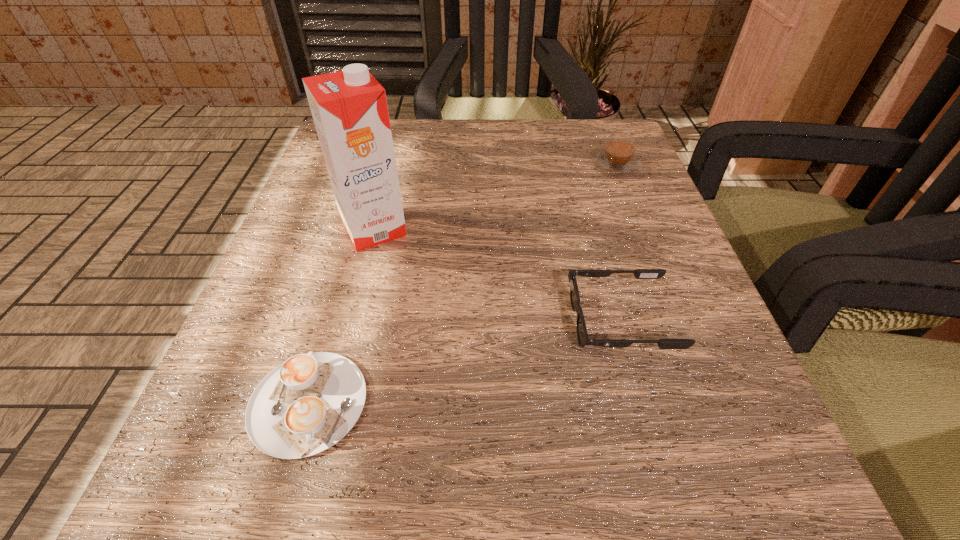
In order to click on the third nearest object in this screenshot , I will do click(349, 108).

Where is `the tallest object`? Image resolution: width=960 pixels, height=540 pixels. the tallest object is located at coordinates (349, 108).

Identify the location of the right cappuccino. Image resolution: width=960 pixels, height=540 pixels. (618, 159).

The height and width of the screenshot is (540, 960). Identify the location of the second tallest object. (618, 159).

Image resolution: width=960 pixels, height=540 pixels. Identify the location of the third tallest object. (582, 335).

Locate an element on the screen. the nearer cappuccino is located at coordinates (307, 404).

Where is `the shortest object`? the shortest object is located at coordinates (307, 404).

Locate an element on the screen. Image resolution: width=960 pixels, height=540 pixels. vacant space located on the back of the second farthest object is located at coordinates (398, 135).

Identify the location of vacant space situated on the left of the farthest object. This screenshot has width=960, height=540. coord(455,166).

At what (x,y) coordinates should I click in order to perform the action: click on vacant area situated 0.230m on the temples of the third tallest object. Please return your answer as a coordinate pair (x, y). Looking at the image, I should click on (402, 321).